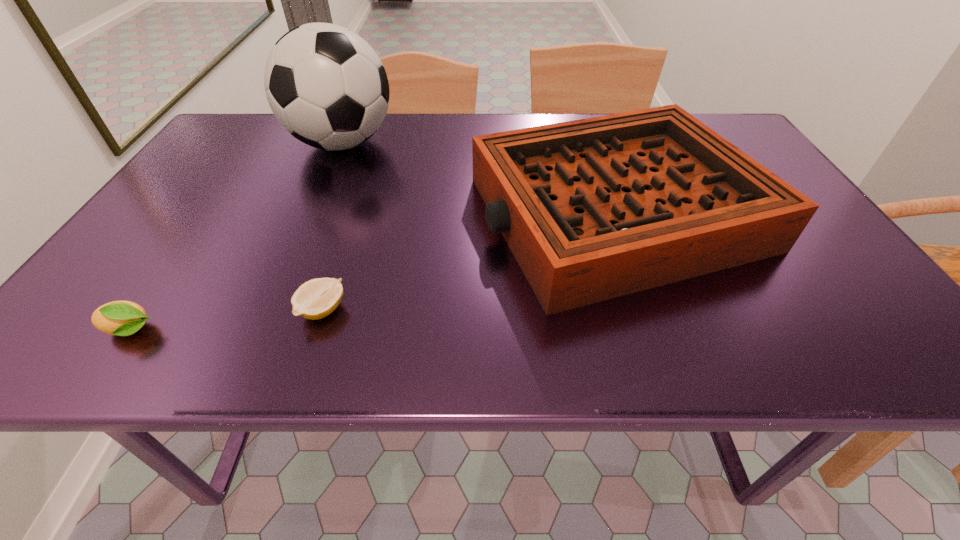
Locate an element on the screen. This screenshot has width=960, height=540. free location at the right edge of the desktop is located at coordinates (863, 318).

The width and height of the screenshot is (960, 540). In the image, there is a desktop. Identify the location of vacant space at the far left corner. (226, 152).

Where is `vacant area that lies between the right lemon and the left lemon`? vacant area that lies between the right lemon and the left lemon is located at coordinates (227, 321).

At what (x,y) coordinates should I click in order to perform the action: click on free area in between the shortest object and the soccer ball. Please return your answer as a coordinate pair (x, y). The width and height of the screenshot is (960, 540). Looking at the image, I should click on (332, 227).

This screenshot has height=540, width=960. Identify the location of free space between the second shortest object and the soccer ball. (236, 237).

Where is `empty space between the soccer ball and the left lemon`? empty space between the soccer ball and the left lemon is located at coordinates (236, 237).

At what (x,y) coordinates should I click in order to perform the action: click on empty space that is in between the left lemon and the rightmost object. Please return your answer as a coordinate pair (x, y). Looking at the image, I should click on (373, 272).

Find the location of a particular element. vacant point located between the second tallest object and the right lemon is located at coordinates (469, 262).

The height and width of the screenshot is (540, 960). I want to click on free point between the gameboard and the second shortest object, so click(373, 272).

Where is `empty space between the shortest object and the left lemon`? Image resolution: width=960 pixels, height=540 pixels. empty space between the shortest object and the left lemon is located at coordinates (227, 321).